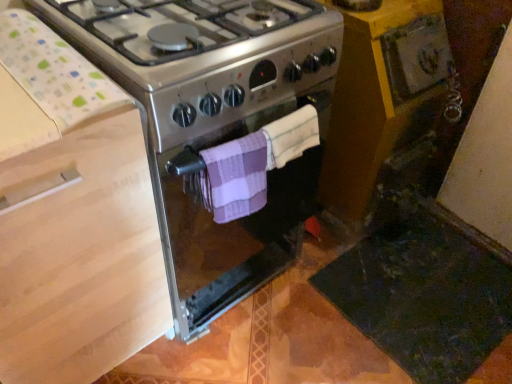
Question: From a real-world perspective, is purple checkered towel at center, positioned as the 1th towel/napkin in left-to-right order, located beneath satin silver gas stove at center?

Choices:
 (A) yes
 (B) no

Answer: (B)

Question: Is purple checkered towel at center, positioned as the 1th towel/napkin in left-to-right order, not within satin silver gas stove at center?

Choices:
 (A) yes
 (B) no

Answer: (A)

Question: Is purple checkered towel at center, positioned as the 1th towel/napkin in left-to-right order, closer to the viewer compared to satin silver gas stove at center?

Choices:
 (A) yes
 (B) no

Answer: (B)

Question: Are purple checkered towel at center, positioned as the 1th towel/napkin in left-to-right order, and satin silver gas stove at center making contact?

Choices:
 (A) yes
 (B) no

Answer: (B)

Question: Considering the relative sizes of purple checkered towel at center, positioned as the 1th towel/napkin in left-to-right order, and satin silver gas stove at center in the image provided, is purple checkered towel at center, positioned as the 1th towel/napkin in left-to-right order, thinner than satin silver gas stove at center?

Choices:
 (A) yes
 (B) no

Answer: (A)

Question: Considering the positions of purple checkered towel at center, positioned as the 1th towel/napkin in left-to-right order, and wooden at left in the image, is purple checkered towel at center, positioned as the 1th towel/napkin in left-to-right order, wider or thinner than wooden at left?

Choices:
 (A) wide
 (B) thin

Answer: (B)

Question: Is purple checkered towel at center, positioned as the 1th towel/napkin in left-to-right order, inside or outside of wooden at left?

Choices:
 (A) inside
 (B) outside

Answer: (B)

Question: From a real-world perspective, is purple checkered towel at center, positioned as the 1th towel/napkin in left-to-right order, positioned above or below wooden at left?

Choices:
 (A) above
 (B) below

Answer: (A)

Question: In terms of size, does purple checkered towel at center, positioned as the 1th towel/napkin in left-to-right order, appear bigger or smaller than wooden at left?

Choices:
 (A) big
 (B) small

Answer: (B)

Question: From their relative heights in the image, would you say wooden at left is taller or shorter than yellow wood cabinet at lower right?

Choices:
 (A) tall
 (B) short

Answer: (A)

Question: From the image's perspective, is wooden at left located above or below yellow wood cabinet at lower right?

Choices:
 (A) below
 (B) above

Answer: (A)

Question: Considering the positions of point (35, 359) and point (397, 59), is point (35, 359) closer or farther from the camera than point (397, 59)?

Choices:
 (A) farther
 (B) closer

Answer: (B)

Question: Considering their positions, is wooden at left located in front of or behind yellow wood cabinet at lower right?

Choices:
 (A) behind
 (B) front

Answer: (B)

Question: Is point (236, 155) closer or farther from the camera than point (374, 81)?

Choices:
 (A) closer
 (B) farther

Answer: (A)

Question: Considering the relative positions of purple checkered towel at center, positioned as the 1th towel/napkin in left-to-right order, and yellow wood cabinet at lower right in the image provided, is purple checkered towel at center, positioned as the 1th towel/napkin in left-to-right order, to the left or to the right of yellow wood cabinet at lower right?

Choices:
 (A) left
 (B) right

Answer: (A)